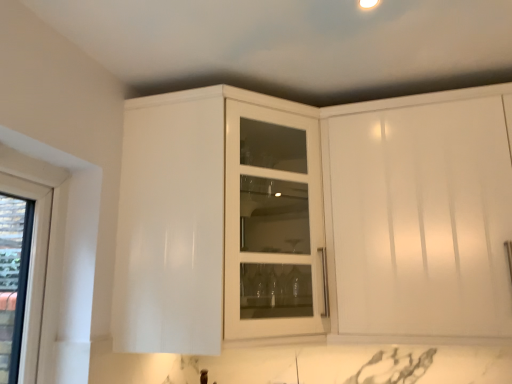
This screenshot has height=384, width=512. I want to click on white glossy cabinet at upper center, so click(313, 217).

The image size is (512, 384). What do you see at coordinates (313, 217) in the screenshot? I see `white glossy cabinet at upper center` at bounding box center [313, 217].

Image resolution: width=512 pixels, height=384 pixels. In order to click on white glossy cabinet at upper center in this screenshot , I will do `click(313, 217)`.